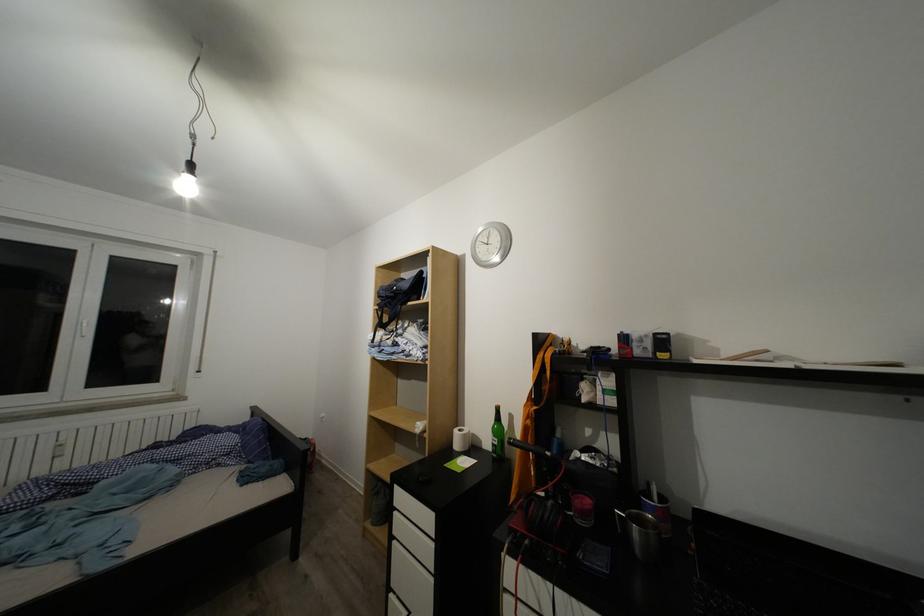
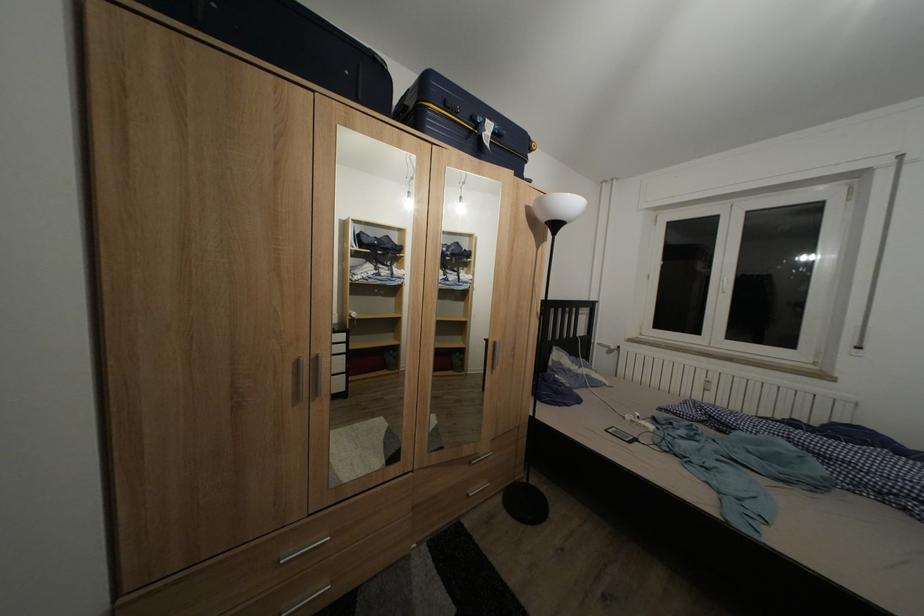
Question: The first image is from the beginning of the video and the second image is from the end. How did the camera likely rotate when shooting the video?

Choices:
 (A) Left
 (B) Right
 (C) Up
 (D) Down

Answer: (A)